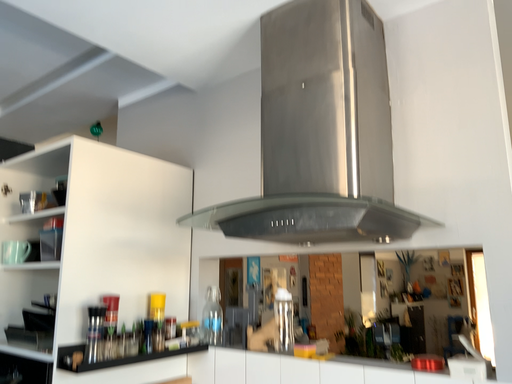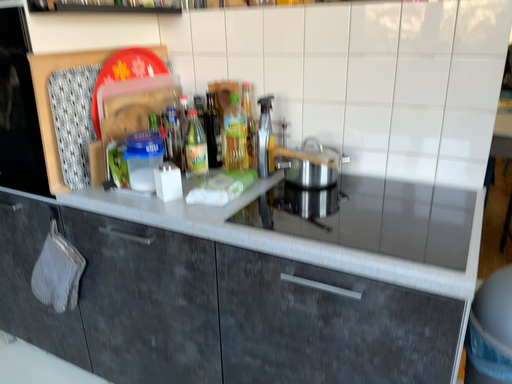
Question: How did the camera likely rotate when shooting the video?

Choices:
 (A) rotated left
 (B) rotated right

Answer: (B)